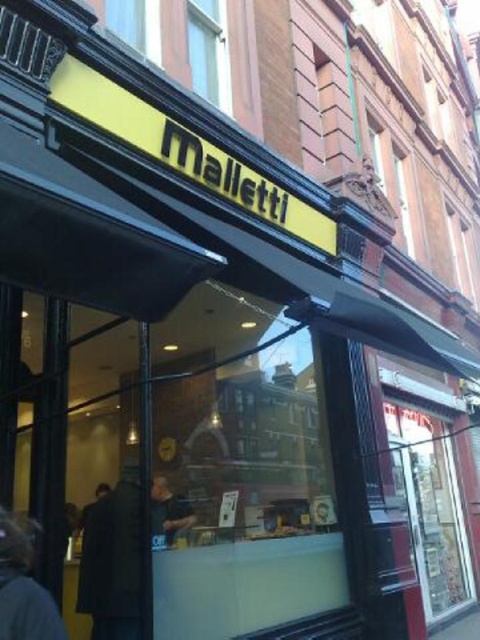
Question: Is dark brown coat at center positioned in front of dark brown leather jacket at lower left?

Choices:
 (A) yes
 (B) no

Answer: (B)

Question: Can you confirm if dark brown coat at center is thinner than dark brown leather jacket at lower left?

Choices:
 (A) no
 (B) yes

Answer: (A)

Question: Which point is farther to the camera?

Choices:
 (A) dark brown leather jacket at lower left
 (B) dark brown coat at center

Answer: (B)

Question: Which object appears farthest from the camera in this image?

Choices:
 (A) dark brown coat at center
 (B) dark brown leather jacket at lower left

Answer: (A)

Question: Can you confirm if dark brown coat at center is positioned to the left of dark brown leather jacket at lower left?

Choices:
 (A) yes
 (B) no

Answer: (B)